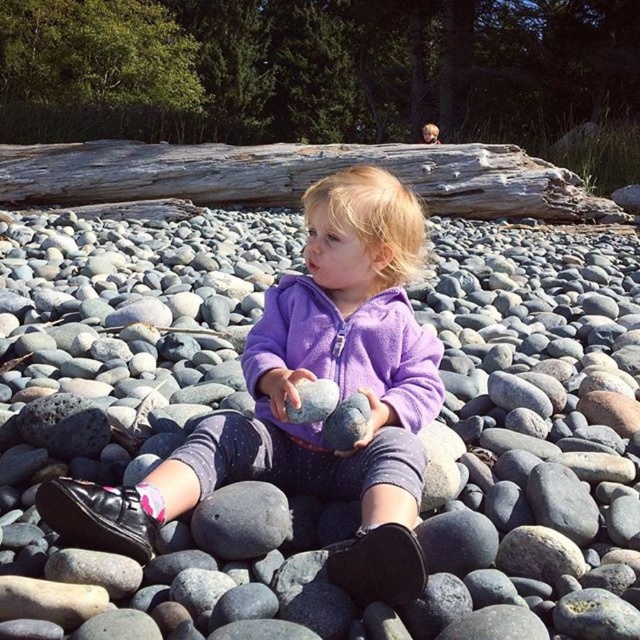
Is purple fleece jacket at center below weathered wood log at upper center?

Correct, purple fleece jacket at center is located below weathered wood log at upper center.

Can you confirm if purple fleece jacket at center is bigger than weathered wood log at upper center?

Actually, purple fleece jacket at center might be smaller than weathered wood log at upper center.

At what (x,y) coordinates should I click in order to perform the action: click on purple fleece jacket at center. Please return your answer as a coordinate pair (x, y). Looking at the image, I should click on (298, 397).

Does point (445, 209) come farther from viewer compared to point (259, 554)?

That is True.

Who is shorter, weathered wood log at upper center or smooth gray rock at center?

With less height is smooth gray rock at center.

Measure the distance between point (188, 186) and camera.

The distance of point (188, 186) from camera is 7.33 meters.

The image size is (640, 640). Find the location of `weathered wood log at upper center`. weathered wood log at upper center is located at coordinates (298, 177).

Which of these two, purple fleece jacket at center or smooth gray rock at center, stands shorter?

smooth gray rock at center is shorter.

Between point (387, 173) and point (252, 516), which one is positioned behind?

Positioned behind is point (387, 173).

Identify the location of purple fleece jacket at center. The height and width of the screenshot is (640, 640). (298, 397).

The image size is (640, 640). Find the location of `purple fleece jacket at center`. purple fleece jacket at center is located at coordinates (298, 397).